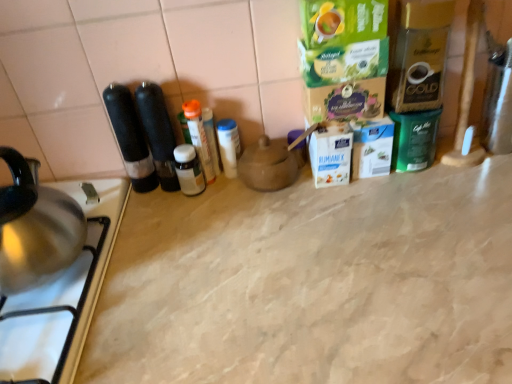
Locate an element on the screen. This screenshot has height=384, width=512. free space in front of white plastic container at center, the 3th bottle in the left-to-right sequence is located at coordinates (241, 222).